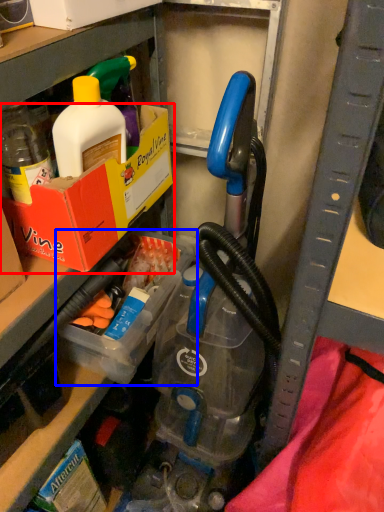
Question: Among these objects, which one is farthest to the camera, box (highlighted by a red box) or storage box (highlighted by a blue box)?

Choices:
 (A) box
 (B) storage box

Answer: (B)